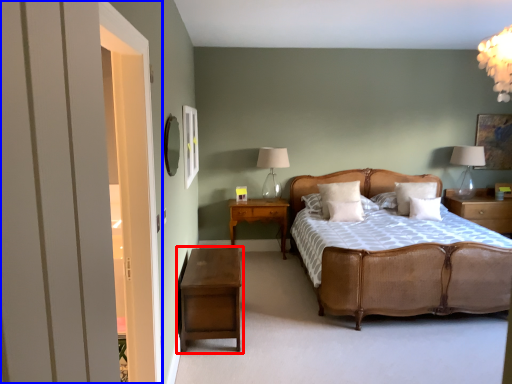
Question: Which point is closer to the camera, nightstand (highlighted by a red box) or door (highlighted by a blue box)?

Choices:
 (A) nightstand
 (B) door

Answer: (B)